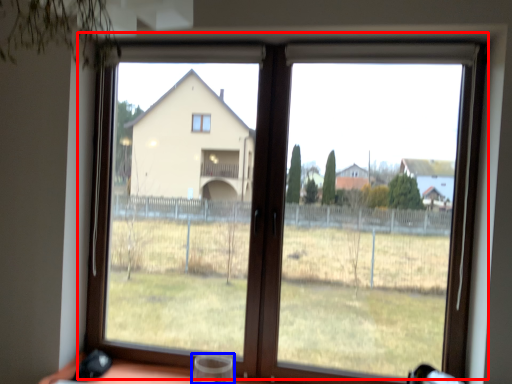
Question: Which object is further to the camera taking this photo, window (highlighted by a red box) or wine glass (highlighted by a blue box)?

Choices:
 (A) window
 (B) wine glass

Answer: (A)